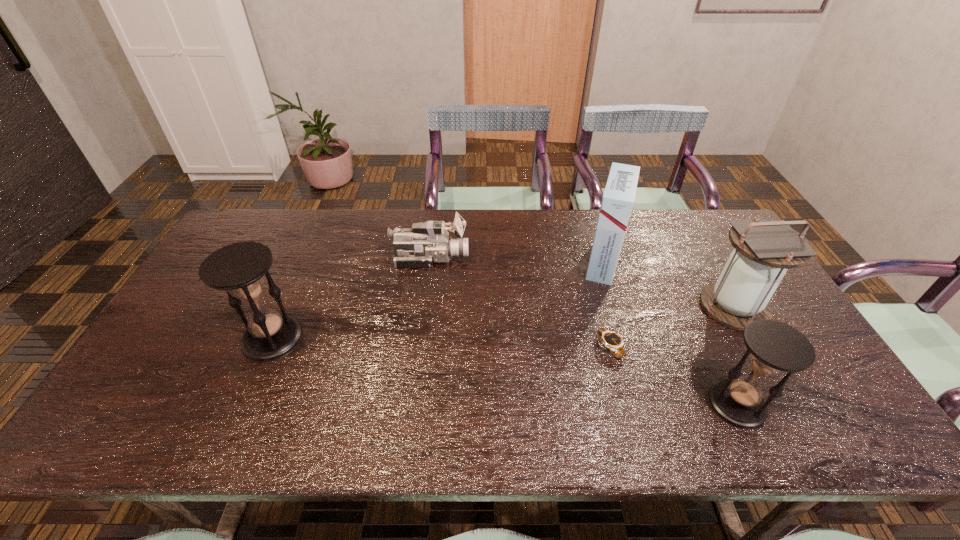
In order to click on vacant region between the watch and the lantern in this screenshot , I will do `click(672, 327)`.

You are a GUI agent. You are given a task and a screenshot of the screen. Output one action in this format:
    pyautogui.click(x=<x>, y=<y>)
    Task: Click on the empty space that is in between the cigarette case and the left hourglass
    
    Given the screenshot: What is the action you would take?
    pyautogui.click(x=438, y=301)

Image resolution: width=960 pixels, height=540 pixels. What are the coordinates of `unoccupied area between the left hourglass and the lantern` in the screenshot? It's located at (503, 323).

I want to click on free space between the leftmost object and the fifth object from right to left, so click(x=351, y=299).

Find the location of a particular element. This screenshot has height=540, width=960. free spot between the leftmost object and the cigarette case is located at coordinates (438, 301).

You are a GUI agent. You are given a task and a screenshot of the screen. Output one action in this format:
    pyautogui.click(x=<x>, y=<y>)
    Task: Click on the object that stands as the closest to the leftmost object
    
    Given the screenshot: What is the action you would take?
    click(428, 242)

The width and height of the screenshot is (960, 540). Identify the location of the closest object to the nearest object. (764, 249).

The image size is (960, 540). I want to click on free location that satisfies the following two spatial constraints: 1. on the front-facing side of the watch; 2. on the right side of the camcorder, so click(419, 347).

Identify the location of free space that satisfies the following two spatial constraints: 1. on the front-facing side of the camcorder; 2. on the left side of the shorter hourglass. This screenshot has width=960, height=540. (412, 404).